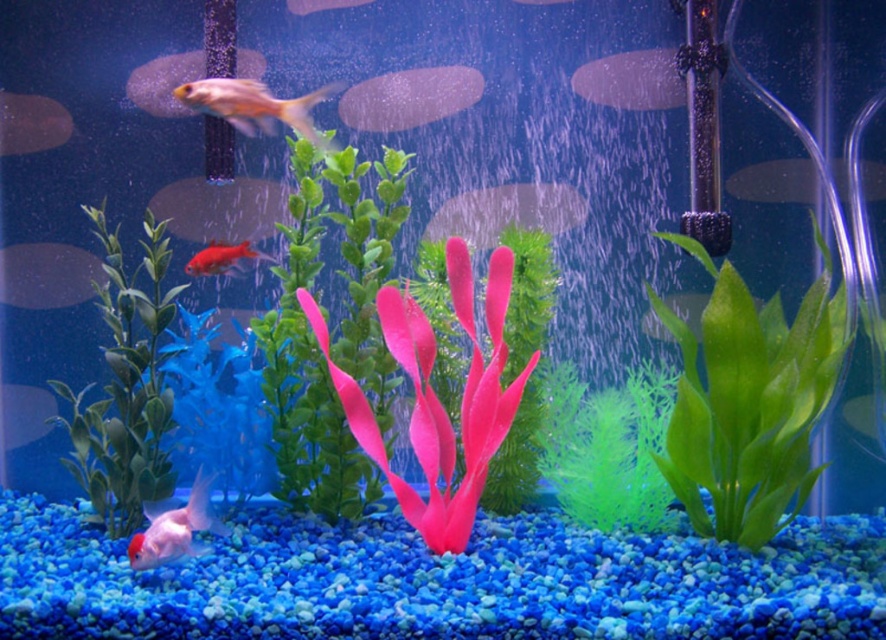
Question: Which point appears farthest from the camera in this image?

Choices:
 (A) (16, 134)
 (B) (243, 256)

Answer: (A)

Question: Is green matte plant at left in front of gold matte fish at upper left?

Choices:
 (A) no
 (B) yes

Answer: (B)

Question: From the image, what is the correct spatial relationship of green matte plant at center in relation to translucent plastic fish at upper center?

Choices:
 (A) below
 (B) above

Answer: (A)

Question: Among these objects, which one is nearest to the camera?

Choices:
 (A) translucent glass fish at upper right
 (B) glossy red goldfish at center
 (C) green matte plant at left

Answer: (C)

Question: Which point is farther from the camera taking this photo?

Choices:
 (A) 343,3
 (B) 634,70

Answer: (B)

Question: Can you confirm if goldfish at upper center is positioned above gold metallic fish at upper left?

Choices:
 (A) yes
 (B) no

Answer: (B)